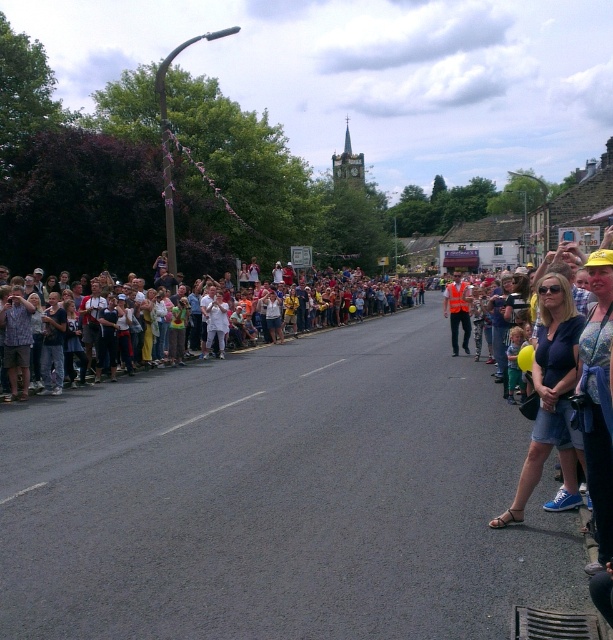
Question: Observing the image, what is the correct spatial positioning of denim shorts at lower right in reference to white cotton crowd at left?

Choices:
 (A) right
 (B) left

Answer: (A)

Question: Which object is positioned farthest from the denim shorts at lower right?

Choices:
 (A) orange reflective vest at center
 (B) white cotton crowd at left

Answer: (B)

Question: Which point is closer to the camera?

Choices:
 (A) [x=299, y=314]
 (B) [x=565, y=412]

Answer: (B)

Question: Can you confirm if denim shorts at lower right is thinner than orange reflective vest at center?

Choices:
 (A) no
 (B) yes

Answer: (B)

Question: Among these points, which one is farthest from the camera?

Choices:
 (A) (447, 300)
 (B) (538, 300)
 (C) (338, 294)

Answer: (C)

Question: Observing the image, what is the correct spatial positioning of denim shorts at lower right in reference to orange reflective vest at center?

Choices:
 (A) left
 (B) right

Answer: (A)